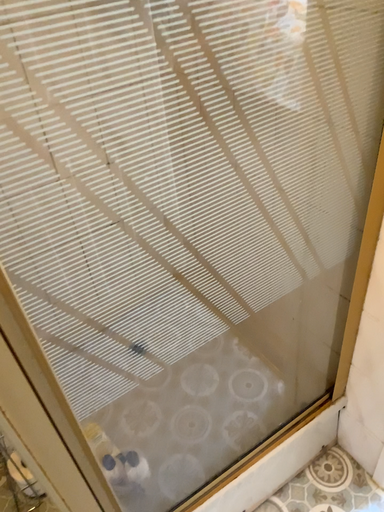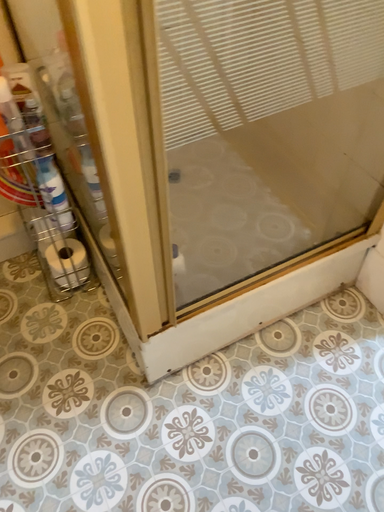
Question: Which way did the camera rotate in the video?

Choices:
 (A) rotated upward
 (B) rotated downward

Answer: (B)